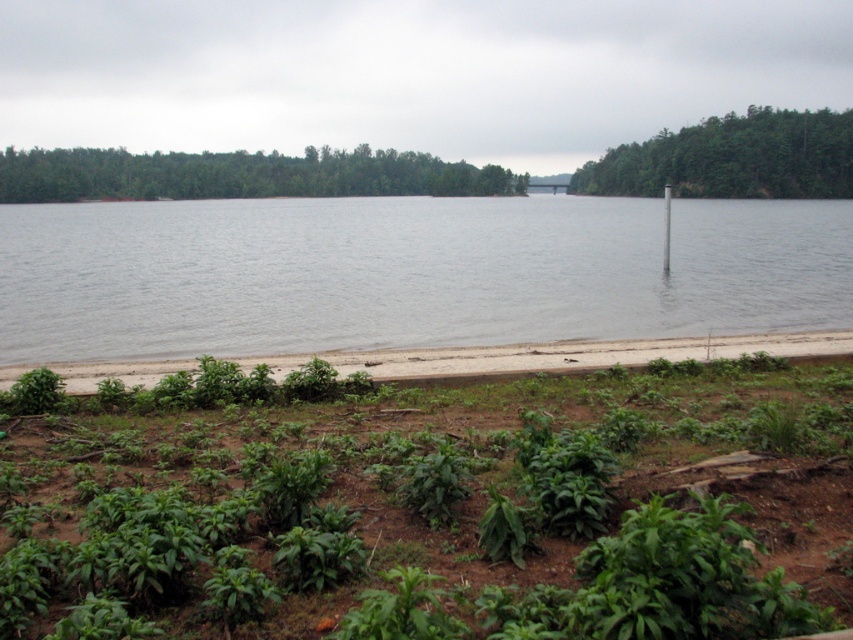
Question: Can you confirm if gray water at center is positioned to the left of white plastic pole at center?

Choices:
 (A) yes
 (B) no

Answer: (A)

Question: Which object is positioned farthest from the white plastic pole at center?

Choices:
 (A) gray water at center
 (B) green leafy trees at upper right
 (C) green leafy plants at lower center

Answer: (C)

Question: Considering the real-world distances, which object is farthest from the green leafy trees at upper center?

Choices:
 (A) green grass at lower center
 (B) green leafy plants at lower center
 (C) green leafy trees at upper right

Answer: (B)

Question: Considering the real-world distances, which object is farthest from the green leafy trees at upper center?

Choices:
 (A) gray water at center
 (B) green grass at lower center
 (C) green leafy plants at lower center

Answer: (C)

Question: Can you confirm if green leafy plants at lower center is smaller than white plastic pole at center?

Choices:
 (A) no
 (B) yes

Answer: (B)

Question: Can you confirm if gray water at center is positioned above white plastic pole at center?

Choices:
 (A) no
 (B) yes

Answer: (A)